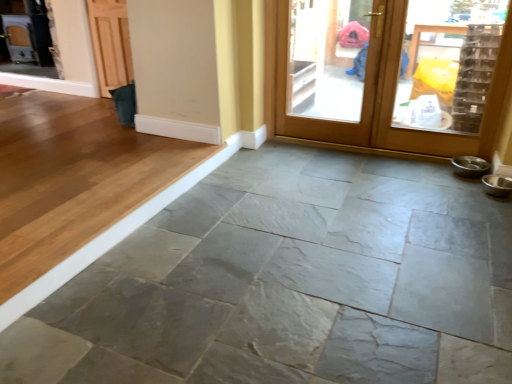
Question: Is wooden door at upper right to the left of gray stone floor at center from the viewer's perspective?

Choices:
 (A) no
 (B) yes

Answer: (A)

Question: From a real-world perspective, is wooden door at upper right on gray stone floor at center?

Choices:
 (A) no
 (B) yes

Answer: (B)

Question: Is wooden door at upper right wider than gray stone floor at center?

Choices:
 (A) no
 (B) yes

Answer: (A)

Question: Could you tell me if wooden door at upper right is turned towards gray stone floor at center?

Choices:
 (A) yes
 (B) no

Answer: (A)

Question: From the image's perspective, does wooden door at upper right appear higher than gray stone floor at center?

Choices:
 (A) yes
 (B) no

Answer: (A)

Question: Choose the correct answer: Is wooden screen door at upper right inside gray stone floor at center or outside it?

Choices:
 (A) inside
 (B) outside

Answer: (B)

Question: From a real-world perspective, is wooden screen door at upper right positioned above or below gray stone floor at center?

Choices:
 (A) below
 (B) above

Answer: (B)

Question: Is wooden screen door at upper right taller or shorter than gray stone floor at center?

Choices:
 (A) tall
 (B) short

Answer: (A)

Question: From the image's perspective, relative to gray stone floor at center, is wooden screen door at upper right above or below?

Choices:
 (A) above
 (B) below

Answer: (A)

Question: From the image's perspective, is gray stone floor at center located above or below wooden door at upper right?

Choices:
 (A) above
 (B) below

Answer: (B)

Question: Visually, is gray stone floor at center positioned to the left or to the right of wooden door at upper right?

Choices:
 (A) right
 (B) left

Answer: (B)

Question: Considering the positions of gray stone floor at center and wooden door at upper right in the image, is gray stone floor at center wider or thinner than wooden door at upper right?

Choices:
 (A) thin
 (B) wide

Answer: (B)

Question: Is gray stone floor at center situated inside wooden door at upper right or outside?

Choices:
 (A) inside
 (B) outside

Answer: (B)

Question: Considering the positions of wooden screen door at upper right and wooden door at upper right in the image, is wooden screen door at upper right bigger or smaller than wooden door at upper right?

Choices:
 (A) big
 (B) small

Answer: (A)

Question: Visually, is wooden screen door at upper right positioned to the left or to the right of wooden door at upper right?

Choices:
 (A) right
 (B) left

Answer: (B)